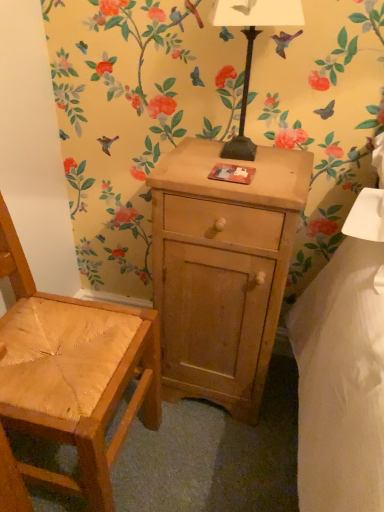
Question: Based on their sizes in the image, would you say light brown wood cabinet at center is bigger or smaller than metallic black lamp at upper center?

Choices:
 (A) big
 (B) small

Answer: (A)

Question: From the image's perspective, is light brown wood cabinet at center positioned above or below metallic black lamp at upper center?

Choices:
 (A) above
 (B) below

Answer: (B)

Question: Which is farther from the light brown wood cabinet at center?

Choices:
 (A) metallic black lamp at upper center
 (B) natural wood chair at left

Answer: (A)

Question: Which is nearer to the light brown wood cabinet at center?

Choices:
 (A) metallic black lamp at upper center
 (B) natural wood chair at left

Answer: (B)